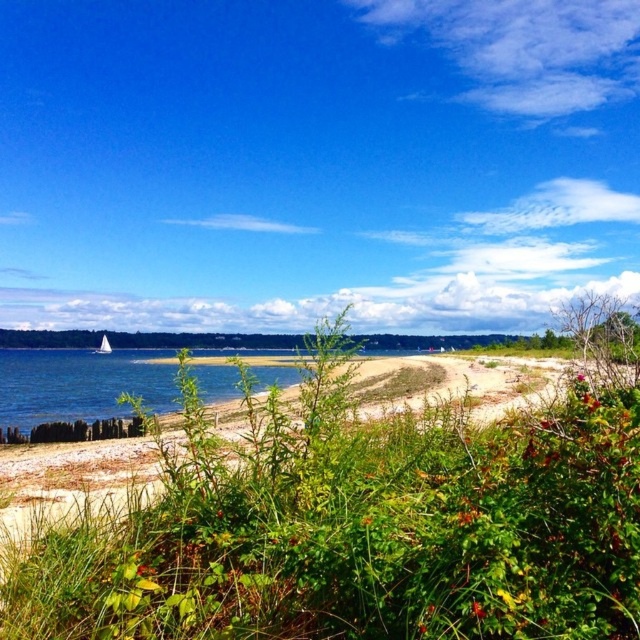
Question: Which object appears closest to the camera in this image?

Choices:
 (A) green leafy shrubs at center
 (B) white sailboat at left

Answer: (A)

Question: Is the position of green leafy shrubs at center less distant than that of white sailboat at left?

Choices:
 (A) yes
 (B) no

Answer: (A)

Question: Which of the following is the closest to the observer?

Choices:
 (A) green leafy shrubs at center
 (B) white sailboat at left

Answer: (A)

Question: Is green leafy shrubs at center positioned behind white sailboat at left?

Choices:
 (A) yes
 (B) no

Answer: (B)

Question: In this image, where is green leafy shrubs at center located relative to white sailboat at left?

Choices:
 (A) left
 (B) right

Answer: (B)